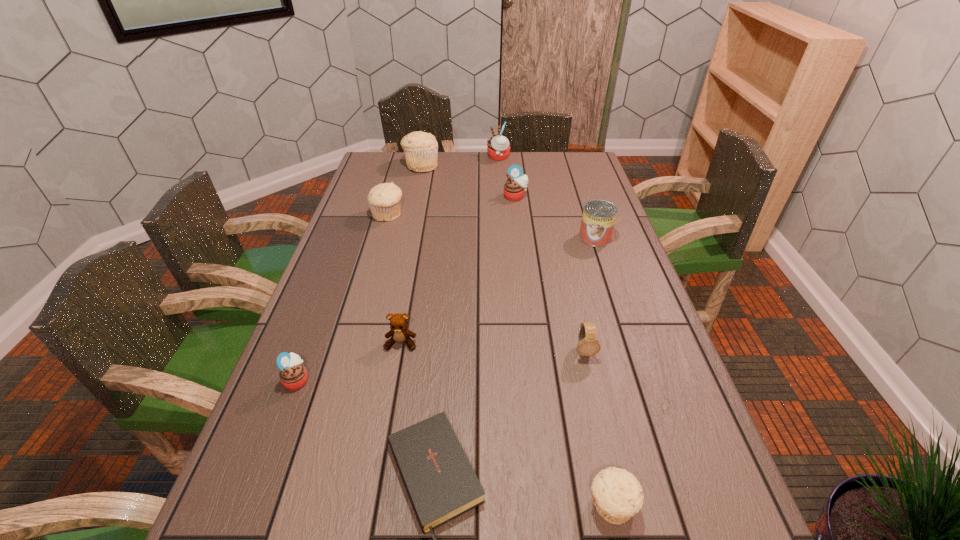
Locate an element on the screen. The width and height of the screenshot is (960, 540). vacant space at the far left corner of the desktop is located at coordinates click(x=382, y=166).

What are the coordinates of `vacant space in between the fourth farthest object and the watch` in the screenshot? It's located at (486, 283).

At what (x,y) coordinates should I click in order to perform the action: click on vacant area between the rightmost beige muffin and the fifth farthest object. Please return your answer as a coordinate pair (x, y). The image size is (960, 540). Looking at the image, I should click on (603, 372).

Where is `free space between the watch and the rightmost beige muffin`? This screenshot has width=960, height=540. free space between the watch and the rightmost beige muffin is located at coordinates (597, 428).

Where is `vacant area that lies between the second smallest beige muffin and the farthest pink muffin`? vacant area that lies between the second smallest beige muffin and the farthest pink muffin is located at coordinates (444, 186).

You are a GUI agent. You are given a task and a screenshot of the screen. Output one action in this format:
    pyautogui.click(x=<x>, y=<y>)
    Task: Click on the vacant space that is in between the can and the smallest beige muffin
    The height and width of the screenshot is (540, 960).
    Given the screenshot: What is the action you would take?
    pyautogui.click(x=603, y=372)

Find the location of `unoccupied position between the rightmost object and the rightmost beige muffin`. unoccupied position between the rightmost object and the rightmost beige muffin is located at coordinates (603, 372).

Locate an element on the screen. This screenshot has height=540, width=960. vacant space in between the watch and the brown teddy bear is located at coordinates (492, 347).

Identify which object is located as the second nearest to the watch. Please provide its 2D coordinates. Your answer should be formatted as a tuple, i.e. [(x, y)], where the tuple contains the x and y coordinates of a point satisfying the conditions above.

[(617, 495)]

Locate an element on the screen. the sixth closest object to the watch is located at coordinates (516, 185).